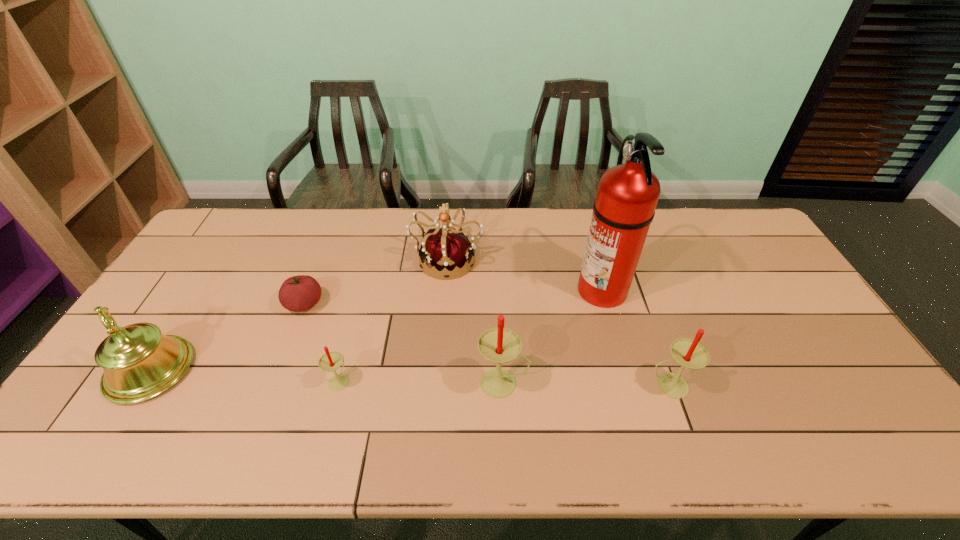
The image size is (960, 540). I want to click on object located in the left edge section of the desktop, so click(x=139, y=362).

In order to click on object that is at the near left corner in this screenshot , I will do `click(139, 362)`.

In the image, there is a desktop. Where is `vacant space at the far edge`? This screenshot has width=960, height=540. vacant space at the far edge is located at coordinates (371, 221).

You are a GUI agent. You are given a task and a screenshot of the screen. Output one action in this format:
    pyautogui.click(x=<x>, y=<y>)
    Task: Click on the vacant space at the near edge of the desktop
    This screenshot has height=540, width=960.
    Given the screenshot: What is the action you would take?
    point(456,407)

This screenshot has width=960, height=540. Find the location of `vacant region at the left edge of the desktop`. vacant region at the left edge of the desktop is located at coordinates (220, 284).

Locate an element on the screen. This screenshot has height=540, width=960. vacant space at the far left corner is located at coordinates (229, 226).

Identify the location of vacant space at the near right corner of the desktop. This screenshot has width=960, height=540. (822, 406).

Where is `free space between the second candle from right to left and the second object from left to right`? Image resolution: width=960 pixels, height=540 pixels. free space between the second candle from right to left and the second object from left to right is located at coordinates (404, 343).

At what (x,y) coordinates should I click in order to perform the action: click on unoccupied area between the tiara and the tallest object. Please return your answer as a coordinate pair (x, y). The image size is (960, 540). Looking at the image, I should click on (524, 274).

Find the location of a particular element. This screenshot has height=540, width=960. vacant space that is in between the fire extinguisher and the tomato is located at coordinates (453, 297).